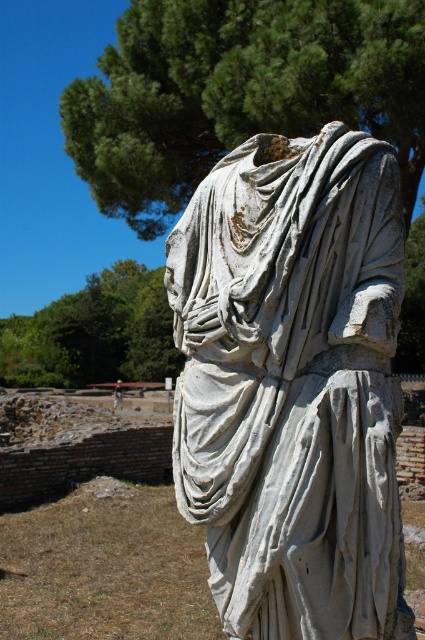
Question: In this image, where is green leafy tree at upper center located relative to green leafy tree at upper left?

Choices:
 (A) left
 (B) right

Answer: (B)

Question: Which of the following is the farthest from the observer?

Choices:
 (A) [x=152, y=346]
 (B) [x=190, y=173]
 (C) [x=119, y=397]

Answer: (A)

Question: Based on their relative distances, which object is nearer to the white marble statue at center?

Choices:
 (A) blurred fabric statue at center
 (B) green leafy tree at upper center

Answer: (B)

Question: Which point is closer to the camera?

Choices:
 (A) (73, 337)
 (B) (362, 106)
 (C) (121, 388)
 (D) (353, 336)

Answer: (D)

Question: Does green leafy tree at upper center have a greater width compared to blurred fabric statue at center?

Choices:
 (A) yes
 (B) no

Answer: (A)

Question: Does green leafy tree at upper center appear under blurred fabric statue at center?

Choices:
 (A) yes
 (B) no

Answer: (B)